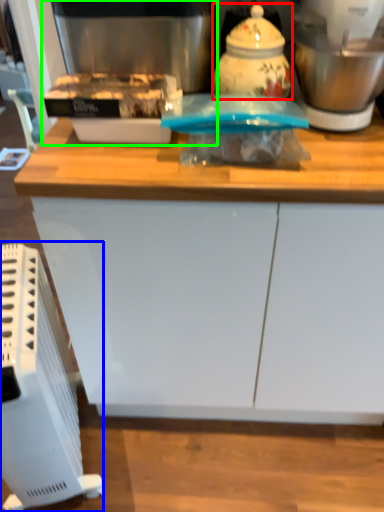
Question: Considering the real-world distances, which object is closest to kitchen appliance (highlighted by a red box)? home appliance (highlighted by a blue box) or coffee machine (highlighted by a green box).

Choices:
 (A) home appliance
 (B) coffee machine

Answer: (B)